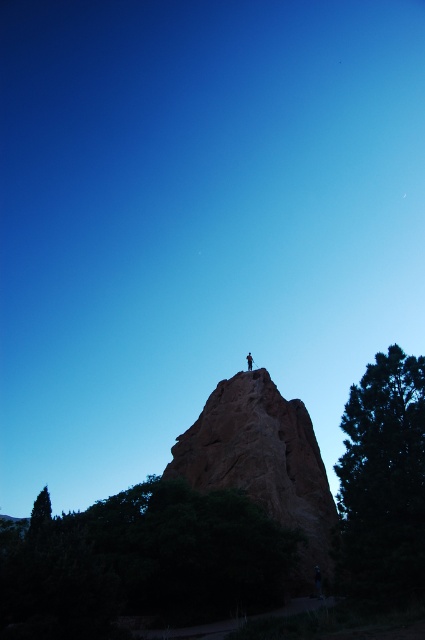
You are a hiker planning to take a photo of the rustic stone peak at center and the green textured tree at right. From your current position, which object should you adjust your camera angle upwards to capture both in the frame?

You should adjust your camera angle upwards to include the green textured tree at right, which is located above the rustic stone peak at center.

You are a hiker who wants to take a photo of the dark brown leather jacket at upper center without the green textured tree at right blocking the view. Which direction should you move to achieve this?

Move to the right side so that the green textured tree at right is no longer blocking the view of the dark brown leather jacket at upper center.